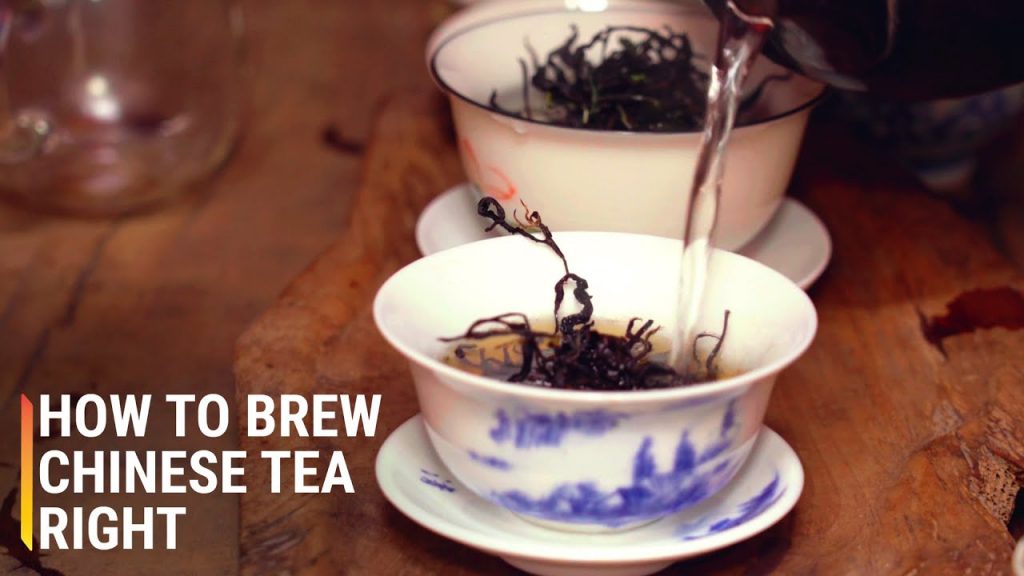
I want to click on saucer, so click(774, 490), click(794, 241).